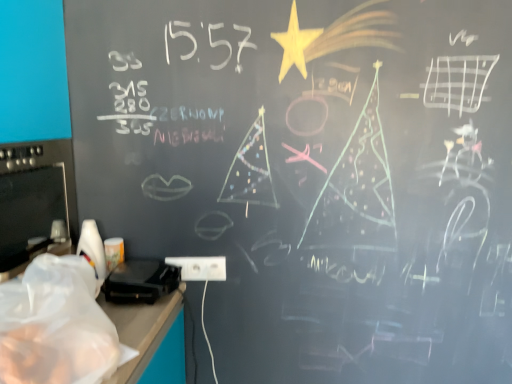
Question: Does transparent plastic bag at lower left come behind black plastic toaster at lower left?

Choices:
 (A) no
 (B) yes

Answer: (A)

Question: Does transparent plastic bag at lower left have a greater height compared to black plastic toaster at lower left?

Choices:
 (A) yes
 (B) no

Answer: (A)

Question: Is transparent plastic bag at lower left to the right of black plastic toaster at lower left from the viewer's perspective?

Choices:
 (A) yes
 (B) no

Answer: (B)

Question: Does transparent plastic bag at lower left have a larger size compared to black plastic toaster at lower left?

Choices:
 (A) yes
 (B) no

Answer: (A)

Question: Considering the relative sizes of transparent plastic bag at lower left and black plastic toaster at lower left in the image provided, is transparent plastic bag at lower left thinner than black plastic toaster at lower left?

Choices:
 (A) yes
 (B) no

Answer: (B)

Question: Is transparent plastic bag at lower left surrounding black plastic toaster at lower left?

Choices:
 (A) no
 (B) yes

Answer: (A)

Question: Can you confirm if black plastic toaster at lower left is shorter than transparent plastic bag at lower left?

Choices:
 (A) yes
 (B) no

Answer: (A)

Question: Does black plastic toaster at lower left appear on the right side of transparent plastic bag at lower left?

Choices:
 (A) yes
 (B) no

Answer: (A)

Question: From a real-world perspective, is black plastic toaster at lower left located beneath transparent plastic bag at lower left?

Choices:
 (A) no
 (B) yes

Answer: (B)

Question: Is black plastic toaster at lower left turned away from transparent plastic bag at lower left?

Choices:
 (A) yes
 (B) no

Answer: (B)

Question: Does black plastic toaster at lower left have a greater width compared to transparent plastic bag at lower left?

Choices:
 (A) no
 (B) yes

Answer: (A)

Question: From the image's perspective, is black plastic toaster at lower left above transparent plastic bag at lower left?

Choices:
 (A) no
 (B) yes

Answer: (A)

Question: Is white plastic electric outlet at lower center with black plastic toaster at lower left?

Choices:
 (A) yes
 (B) no

Answer: (B)